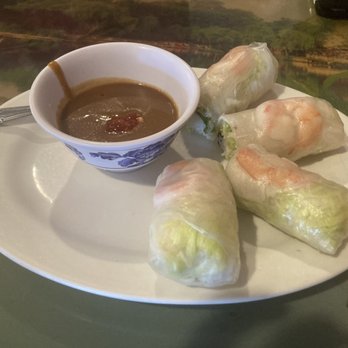
The height and width of the screenshot is (348, 348). I want to click on white plate, so click(x=134, y=280).